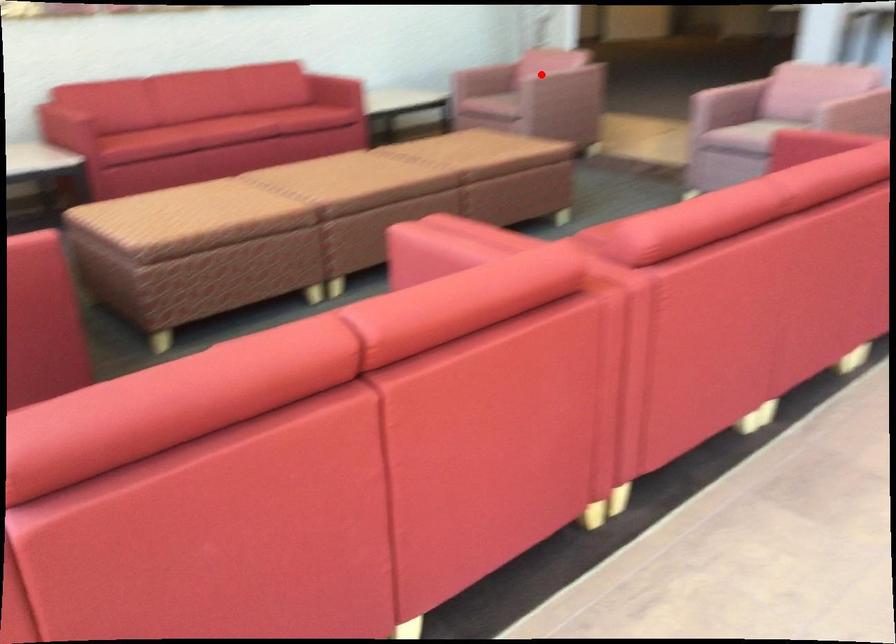
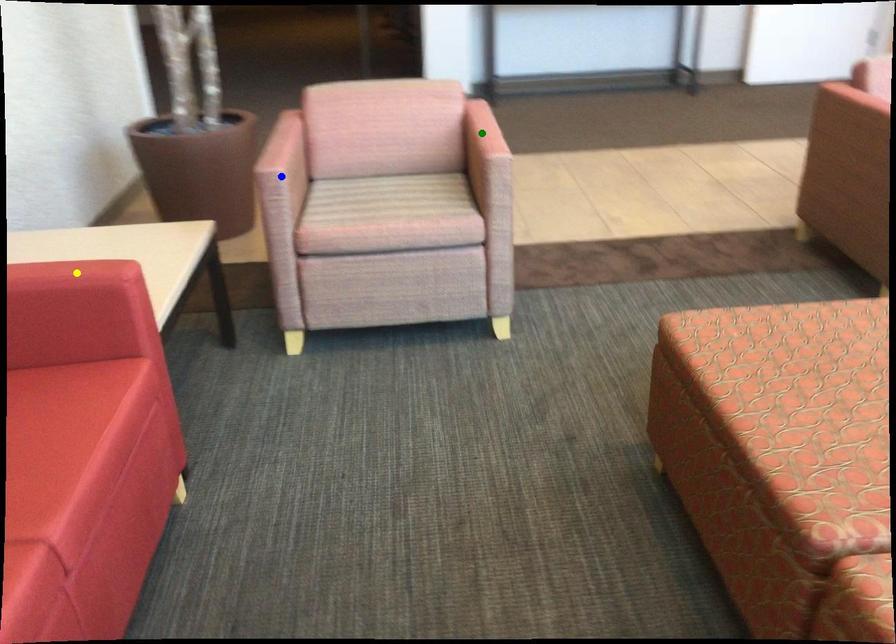
Question: I am providing you with two images of the same scene from different viewpoints. A red point is marked on the first image. You are given multiple points on the second image. Which point in image 2 is actually the same real-world point as the red point in image 1?

Choices:
 (A) yellow point
 (B) green point
 (C) blue point

Answer: (B)